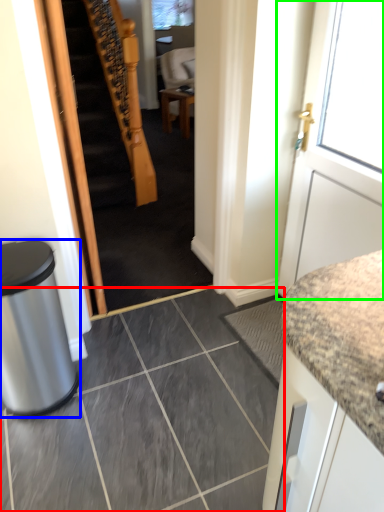
Question: Based on their relative distances, which object is farther from ceramic tile (highlighted by a red box)? Choose from trash bin/can (highlighted by a blue box) and door (highlighted by a green box).

Choices:
 (A) trash bin/can
 (B) door

Answer: (B)